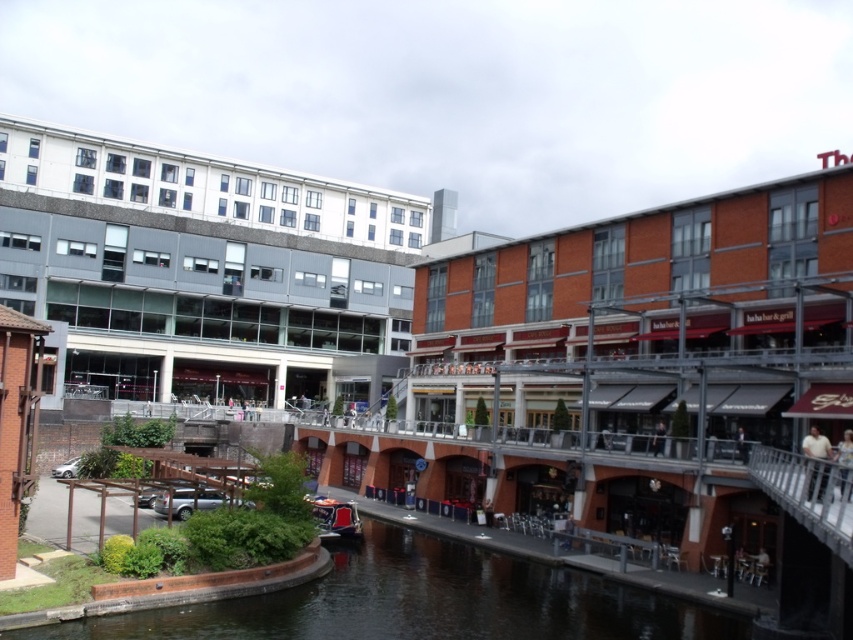
Question: Which of the following is the closest to the observer?

Choices:
 (A) (318, 513)
 (B) (321, 582)

Answer: (B)

Question: Is smooth concrete river at center below metallic red boat at center?

Choices:
 (A) no
 (B) yes

Answer: (B)

Question: Among these objects, which one is nearest to the camera?

Choices:
 (A) metallic red boat at center
 (B) smooth concrete river at center

Answer: (B)

Question: Is smooth concrete river at center smaller than metallic red boat at center?

Choices:
 (A) no
 (B) yes

Answer: (A)

Question: Does smooth concrete river at center come behind metallic red boat at center?

Choices:
 (A) no
 (B) yes

Answer: (A)